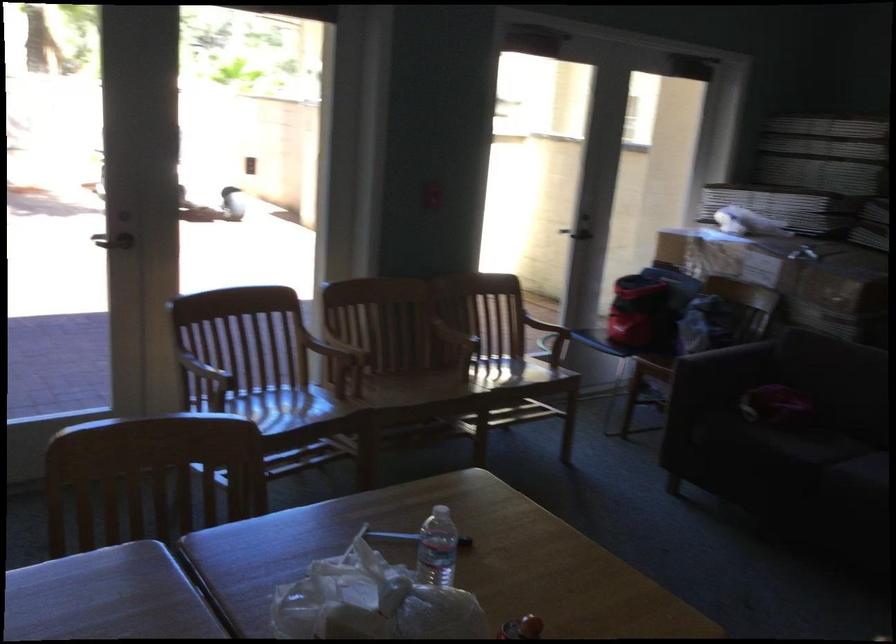
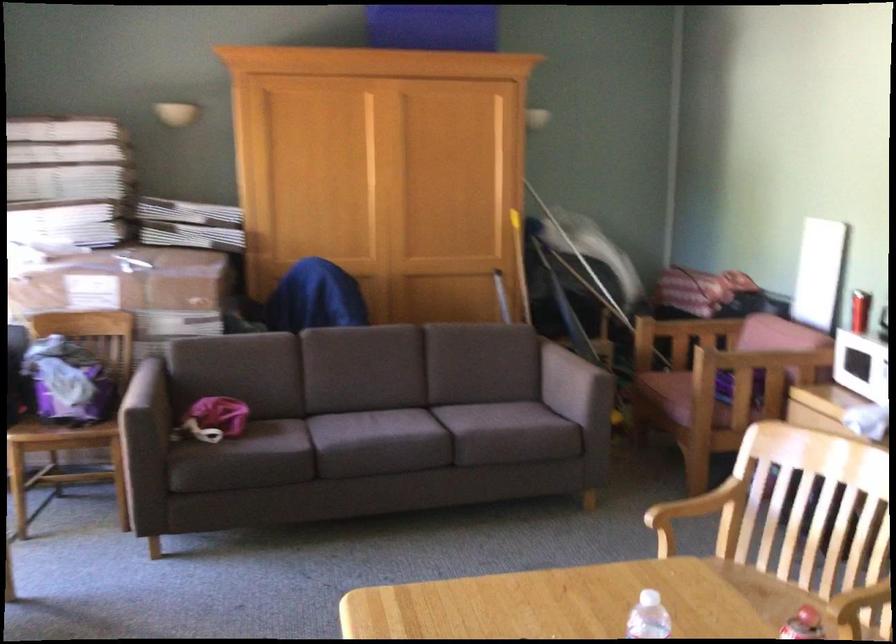
Where in the second image is the point corresponding to [565,573] from the first image?

(555, 603)